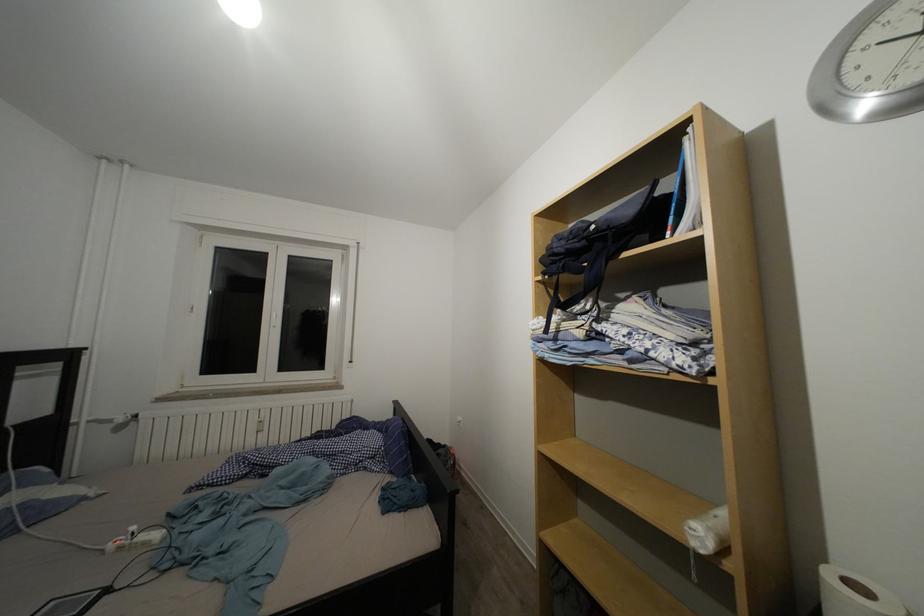
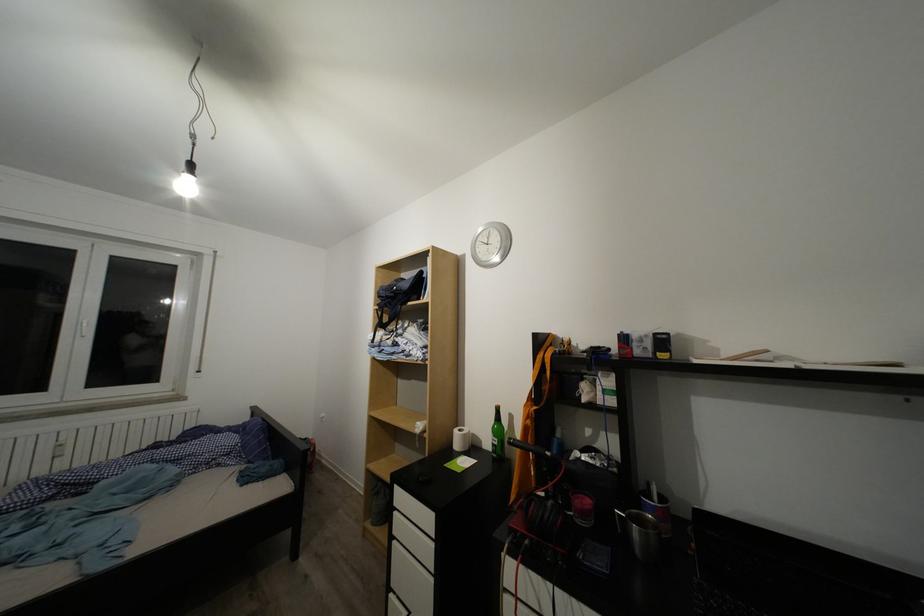
Question: Based on the continuous images, in which direction is the camera rotating? Reply with the corresponding letter.

Choices:
 (A) Left
 (B) Right
 (C) Up
 (D) Down

Answer: (B)